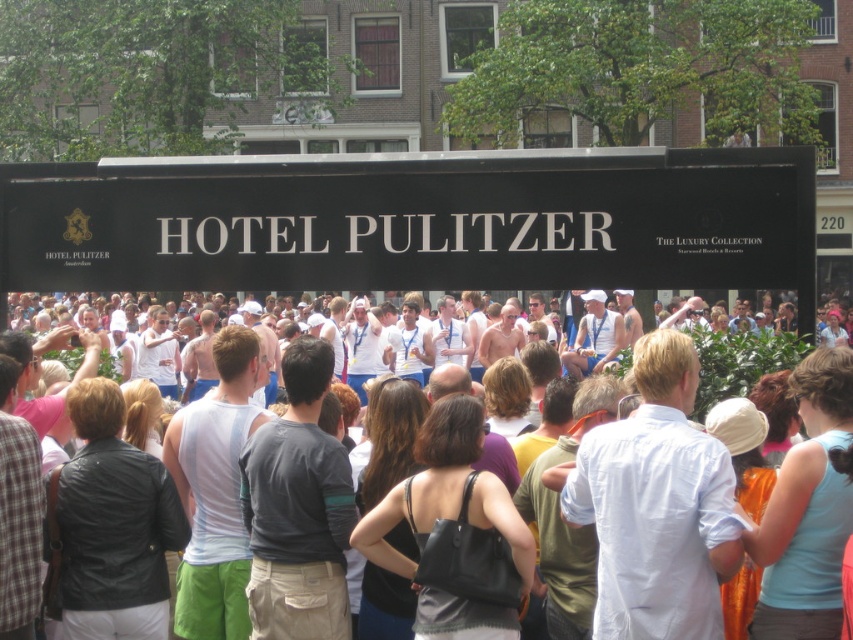
Is black matte sign at upper center closer to the viewer compared to white cotton tank tops at center?

No, black matte sign at upper center is behind white cotton tank tops at center.

Can you confirm if black matte sign at upper center is shorter than white cotton tank tops at center?

Yes, black matte sign at upper center is shorter than white cotton tank tops at center.

Who is more forward, (544, 243) or (775, 410)?

Positioned in front is point (775, 410).

Where is `black matte sign at upper center`? black matte sign at upper center is located at coordinates (413, 221).